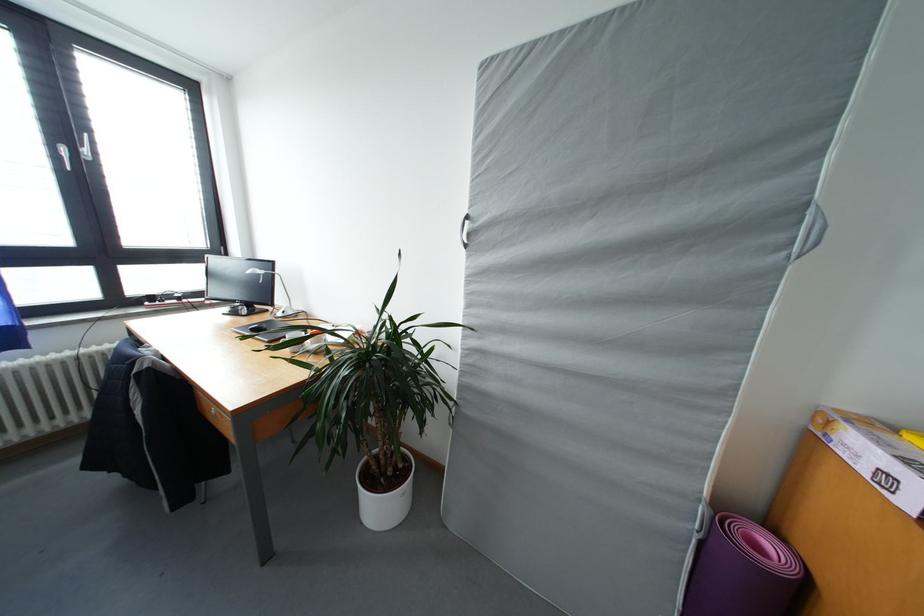
Find the location of `white window handle`. white window handle is located at coordinates pos(64,155).